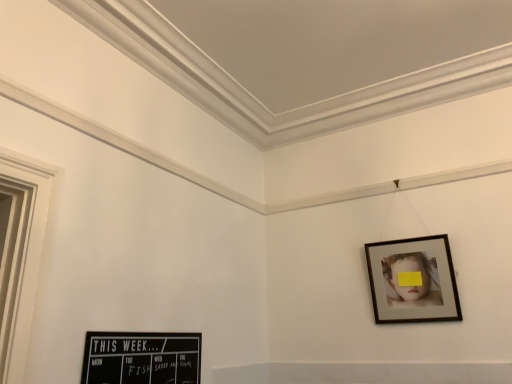
The image size is (512, 384). What do you see at coordinates (141, 358) in the screenshot?
I see `black chalkboard at lower left, which is the second picture frame from back to front` at bounding box center [141, 358].

Measure the distance between point (116, 369) and camera.

Point (116, 369) and camera are 1.69 meters apart.

I want to click on black chalkboard at lower left, which is the second picture frame from back to front, so click(x=141, y=358).

The image size is (512, 384). What do you see at coordinates (413, 280) in the screenshot?
I see `wooden frame at upper right, which is the second picture frame in left-to-right order` at bounding box center [413, 280].

Locate an element on the screen. The width and height of the screenshot is (512, 384). wooden frame at upper right, which appears as the 2th picture frame when viewed from the front is located at coordinates (413, 280).

The width and height of the screenshot is (512, 384). In order to click on black chalkboard at lower left, which is the second picture frame from back to front in this screenshot , I will do `click(141, 358)`.

Between black chalkboard at lower left, the first picture frame from the front, and wooden frame at upper right, which appears as the 2th picture frame when viewed from the front, which one appears on the right side from the viewer's perspective?

Positioned to the right is wooden frame at upper right, which appears as the 2th picture frame when viewed from the front.

Which object is further away from the camera taking this photo, black chalkboard at lower left, the first picture frame from the front, or wooden frame at upper right, the 1th picture frame from the right?

wooden frame at upper right, the 1th picture frame from the right.

Does point (187, 335) lie behind point (453, 278)?

No, it is not.

From the image's perspective, is black chalkboard at lower left, acting as the 1th picture frame starting from the left, above wooden frame at upper right, which is the second picture frame in left-to-right order?

No, from the image's perspective, black chalkboard at lower left, acting as the 1th picture frame starting from the left, is not above wooden frame at upper right, which is the second picture frame in left-to-right order.

From a real-world perspective, is black chalkboard at lower left, acting as the 1th picture frame starting from the left, above or below wooden frame at upper right, which appears as the 2th picture frame when viewed from the front?

black chalkboard at lower left, acting as the 1th picture frame starting from the left, is situated lower than wooden frame at upper right, which appears as the 2th picture frame when viewed from the front, in the real world.

Is black chalkboard at lower left, the 2th picture frame in the right-to-left sequence, wider or thinner than wooden frame at upper right, the 1th picture frame from the right?

Clearly, black chalkboard at lower left, the 2th picture frame in the right-to-left sequence, has less width compared to wooden frame at upper right, the 1th picture frame from the right.

Based on the photo, is black chalkboard at lower left, acting as the 1th picture frame starting from the left, shorter than wooden frame at upper right, the 1th picture frame from the right?

Correct, black chalkboard at lower left, acting as the 1th picture frame starting from the left, is not as tall as wooden frame at upper right, the 1th picture frame from the right.

In terms of size, does black chalkboard at lower left, the 2th picture frame in the right-to-left sequence, appear bigger or smaller than wooden frame at upper right, the 1th picture frame from the right?

black chalkboard at lower left, the 2th picture frame in the right-to-left sequence, is smaller than wooden frame at upper right, the 1th picture frame from the right.

Which is correct: black chalkboard at lower left, the first picture frame from the front, is inside wooden frame at upper right, which is the second picture frame in left-to-right order, or outside of it?

black chalkboard at lower left, the first picture frame from the front, lies outside wooden frame at upper right, which is the second picture frame in left-to-right order.

Are black chalkboard at lower left, which is the second picture frame from back to front, and wooden frame at upper right, which appears as the 2th picture frame when viewed from the front, far apart?

Absolutely, black chalkboard at lower left, which is the second picture frame from back to front, is distant from wooden frame at upper right, which appears as the 2th picture frame when viewed from the front.

Is wooden frame at upper right, which ranks as the first picture frame in back-to-front order, at the back of black chalkboard at lower left, acting as the 1th picture frame starting from the left?

No, wooden frame at upper right, which ranks as the first picture frame in back-to-front order, is not at the back of black chalkboard at lower left, acting as the 1th picture frame starting from the left.

How different are the orientations of black chalkboard at lower left, which is the second picture frame from back to front, and wooden frame at upper right, the 1th picture frame from the right, in degrees?

black chalkboard at lower left, which is the second picture frame from back to front, and wooden frame at upper right, the 1th picture frame from the right, are facing 90.4 degrees away from each other.

Locate an element on the screen. picture frame on the left of wooden frame at upper right, the 1th picture frame from the right is located at coordinates (141, 358).

Considering the positions of objects wooden frame at upper right, which ranks as the first picture frame in back-to-front order, and black chalkboard at lower left, the 2th picture frame in the right-to-left sequence, in the image provided, who is more to the right, wooden frame at upper right, which ranks as the first picture frame in back-to-front order, or black chalkboard at lower left, the 2th picture frame in the right-to-left sequence,?

wooden frame at upper right, which ranks as the first picture frame in back-to-front order.

In the image, is wooden frame at upper right, which appears as the 2th picture frame when viewed from the front, positioned in front of or behind black chalkboard at lower left, the first picture frame from the front?

Clearly, wooden frame at upper right, which appears as the 2th picture frame when viewed from the front, is behind black chalkboard at lower left, the first picture frame from the front.

Considering the positions of point (428, 283) and point (96, 377), is point (428, 283) closer or farther from the camera than point (96, 377)?

Point (428, 283).

From the image's perspective, between wooden frame at upper right, which ranks as the first picture frame in back-to-front order, and black chalkboard at lower left, the 2th picture frame in the right-to-left sequence, who is located below?

From the image's view, black chalkboard at lower left, the 2th picture frame in the right-to-left sequence, is below.

From a real-world perspective, between wooden frame at upper right, which is the second picture frame in left-to-right order, and black chalkboard at lower left, acting as the 1th picture frame starting from the left, who is vertically higher?

From a 3D spatial view, wooden frame at upper right, which is the second picture frame in left-to-right order, is above.

Looking at their sizes, would you say wooden frame at upper right, the 1th picture frame from the right, is wider or thinner than black chalkboard at lower left, which is the second picture frame from back to front?

Considering their sizes, wooden frame at upper right, the 1th picture frame from the right, looks broader than black chalkboard at lower left, which is the second picture frame from back to front.

Which of these two, wooden frame at upper right, which ranks as the first picture frame in back-to-front order, or black chalkboard at lower left, acting as the 1th picture frame starting from the left, stands taller?

wooden frame at upper right, which ranks as the first picture frame in back-to-front order, is taller.

Which of these two, wooden frame at upper right, the 1th picture frame from the right, or black chalkboard at lower left, acting as the 1th picture frame starting from the left, is bigger?

Bigger between the two is wooden frame at upper right, the 1th picture frame from the right.

Would you say wooden frame at upper right, the 1th picture frame from the right, contains black chalkboard at lower left, acting as the 1th picture frame starting from the left?

That's incorrect, black chalkboard at lower left, acting as the 1th picture frame starting from the left, is not inside wooden frame at upper right, the 1th picture frame from the right.

Does wooden frame at upper right, which ranks as the first picture frame in back-to-front order, touch black chalkboard at lower left, the 2th picture frame in the right-to-left sequence?

wooden frame at upper right, which ranks as the first picture frame in back-to-front order, and black chalkboard at lower left, the 2th picture frame in the right-to-left sequence, are not in contact.

Could you tell me if wooden frame at upper right, which ranks as the first picture frame in back-to-front order, is facing black chalkboard at lower left, the first picture frame from the front?

No, wooden frame at upper right, which ranks as the first picture frame in back-to-front order, is not aimed at black chalkboard at lower left, the first picture frame from the front.

How many degrees apart are the facing directions of wooden frame at upper right, which is the second picture frame in left-to-right order, and black chalkboard at lower left, which is the second picture frame from back to front?

They differ by 90.4 degrees in their facing directions.

Find the location of a particular element. picture frame located in front of the wooden frame at upper right, which ranks as the first picture frame in back-to-front order is located at coordinates (141, 358).

Image resolution: width=512 pixels, height=384 pixels. Identify the location of picture frame that appears on the right of black chalkboard at lower left, which is the second picture frame from back to front. (413, 280).

Identify the location of picture frame that is above the black chalkboard at lower left, acting as the 1th picture frame starting from the left (from the image's perspective). The height and width of the screenshot is (384, 512). (413, 280).